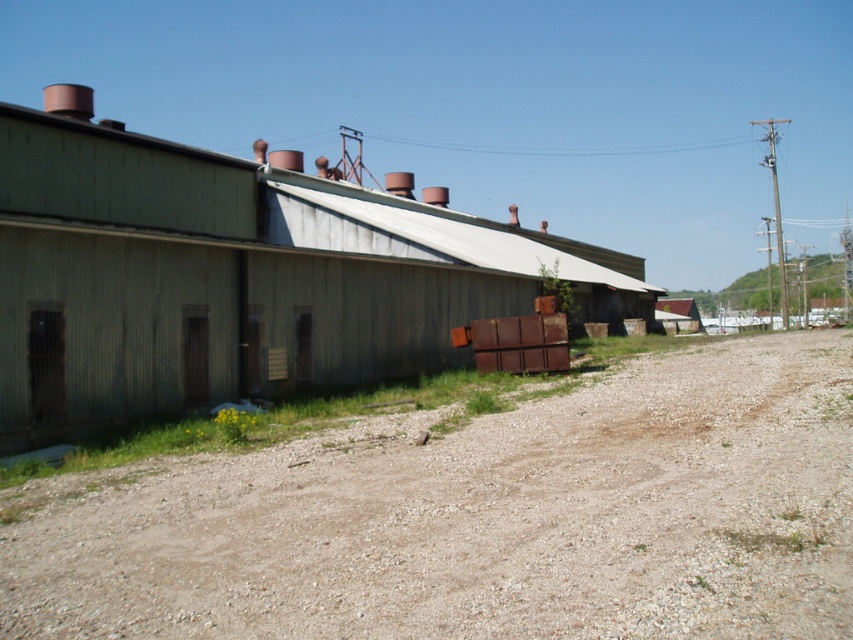
Who is shorter, brown gravel dirt track at center or green corrugated metal barn at center?

brown gravel dirt track at center is shorter.

Is point (329, 468) positioned in front of point (521, 243)?

Yes.

Who is more distant from viewer, (827, 356) or (498, 241)?

The point (498, 241) is behind.

Find the location of `brown gravel dirt track at center`. brown gravel dirt track at center is located at coordinates (488, 518).